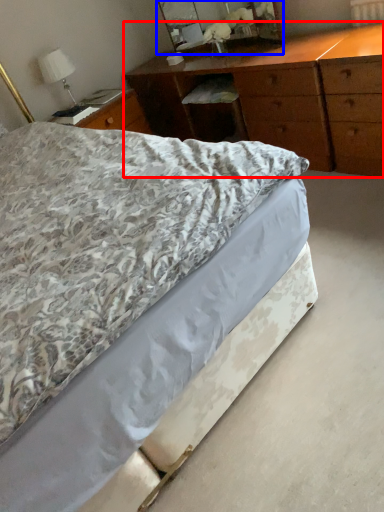
Question: Which point is further to the camera, chest of drawers (highlighted by a red box) or mirror (highlighted by a blue box)?

Choices:
 (A) chest of drawers
 (B) mirror

Answer: (B)